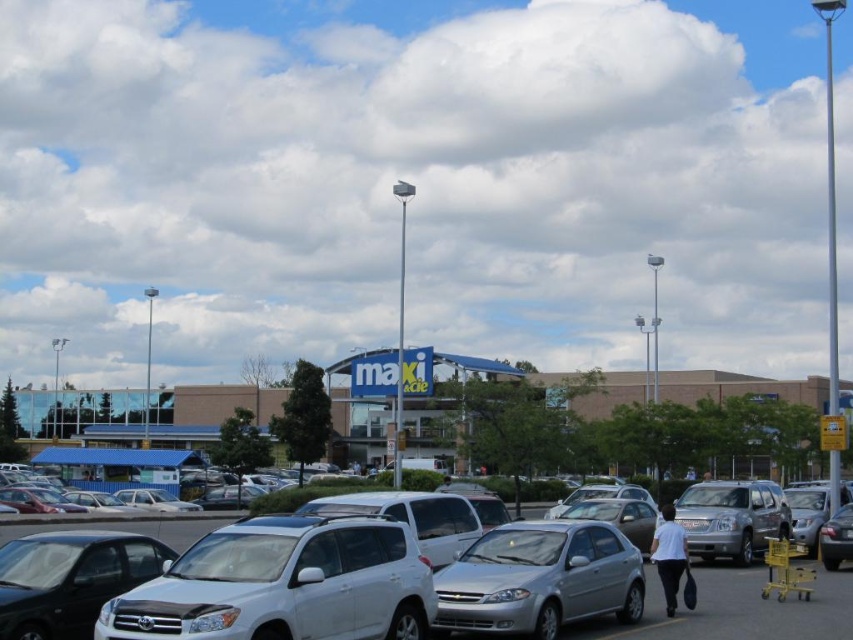
Question: Which point appears closest to the camera in this image?

Choices:
 (A) (212, 595)
 (B) (112, 528)
 (C) (670, 371)
 (D) (686, 538)

Answer: (A)

Question: Estimate the real-world distances between objects in this image. Which object is farther from the shiny black sedan at lower left?

Choices:
 (A) white matte car at center
 (B) white cotton shirt at center

Answer: (A)

Question: Can you confirm if white matte suv at center is wider than white matte car at center?

Choices:
 (A) yes
 (B) no

Answer: (B)

Question: Can you confirm if white matte car at center is smaller than white cotton shirt at center?

Choices:
 (A) yes
 (B) no

Answer: (B)

Question: Which point appears closest to the camera in this image?

Choices:
 (A) (614, 400)
 (B) (844, 556)
 (C) (387, 531)
 (D) (164, 529)

Answer: (C)

Question: Does blue brick mall at center appear under white matte car at center?

Choices:
 (A) no
 (B) yes

Answer: (B)